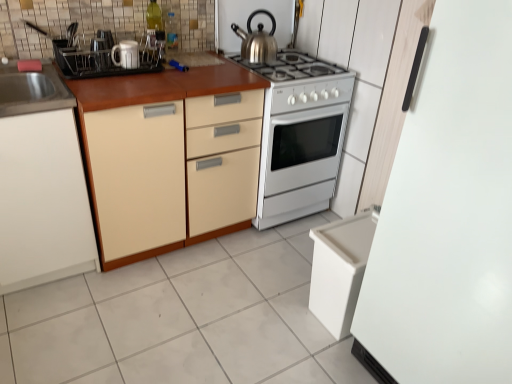
At what (x,y) coordinates should I click in order to perform the action: click on vacant space that is to the left of white plastic dishwasher at lower right. Please return your answer as a coordinate pair (x, y). The height and width of the screenshot is (384, 512). Looking at the image, I should click on (280, 311).